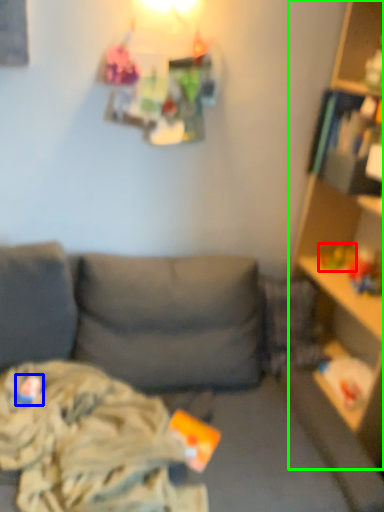
Question: Considering the real-world distances, which object is closest to toy (highlighted by a red box)? toy (highlighted by a blue box) or shelf (highlighted by a green box).

Choices:
 (A) toy
 (B) shelf

Answer: (B)